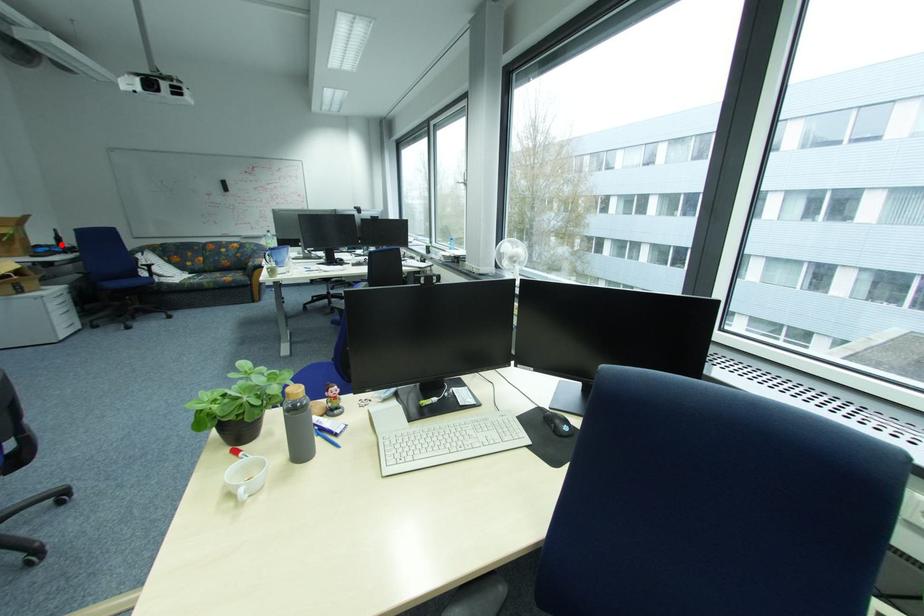
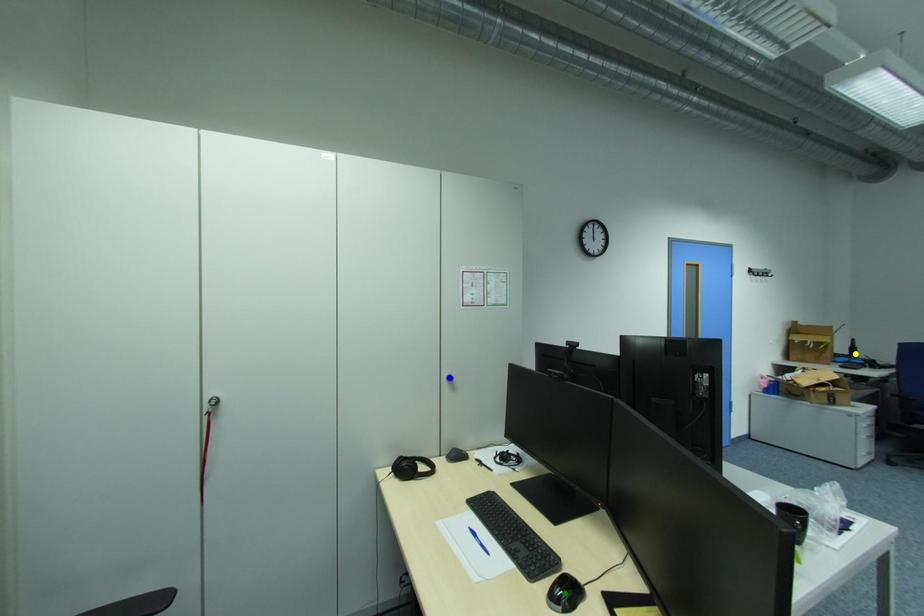
Question: I am providing you with two images of the same scene from different viewpoints. A red point is marked on the first image. You are given multiple points on the second image. Which spot in image 2 lines up with the point in image 1?

Choices:
 (A) blue point
 (B) green point
 (C) yellow point

Answer: (C)